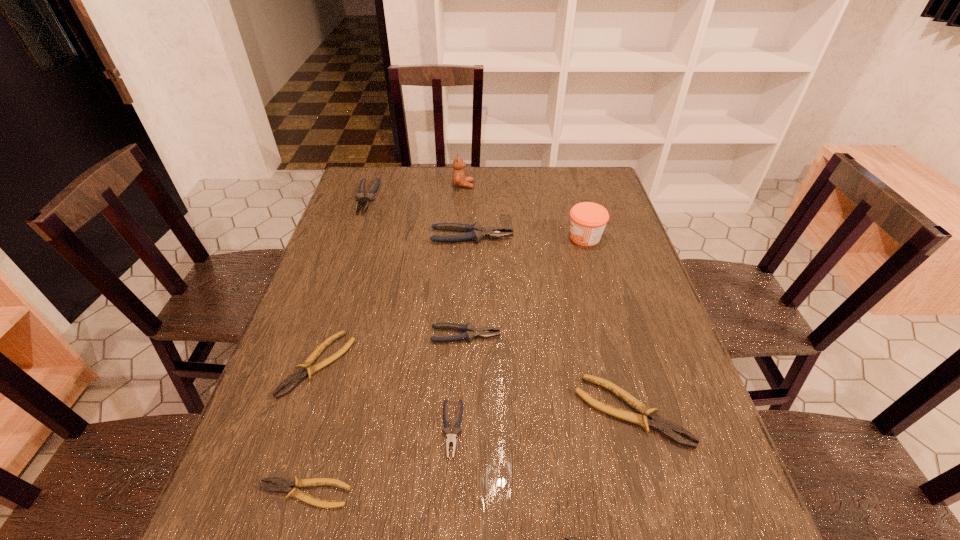
Where is `free space at the left edge of the desktop`? This screenshot has height=540, width=960. free space at the left edge of the desktop is located at coordinates [337, 312].

This screenshot has height=540, width=960. I want to click on vacant area at the right edge of the desktop, so click(x=619, y=326).

The width and height of the screenshot is (960, 540). What are the coordinates of `free region at the far left corner of the desktop` in the screenshot? It's located at (349, 192).

Image resolution: width=960 pixels, height=540 pixels. What are the coordinates of `vacant region at the far right corner of the desktop` in the screenshot? It's located at (576, 174).

The width and height of the screenshot is (960, 540). I want to click on vacant area that lies between the biggest yellow pliers and the nearest gray pliers, so click(x=541, y=420).

At what (x,y) coordinates should I click in order to perform the action: click on empty space that is in between the third smallest yellow pliers and the seventh shortest object. Please return your answer as a coordinate pair (x, y). This screenshot has height=540, width=960. Looking at the image, I should click on point(342,281).

Locate an element on the screen. vacant area between the seventh shortest object and the second nearest object is located at coordinates (335, 346).

Locate an element on the screen. The width and height of the screenshot is (960, 540). empty location between the fourth tallest object and the biggest yellow pliers is located at coordinates (499, 305).

At what (x,y) coordinates should I click in order to perform the action: click on free space between the third smallest yellow pliers and the tallest object. Please return your answer as a coordinate pair (x, y). This screenshot has width=960, height=540. Looking at the image, I should click on (391, 275).

Where is `free spot between the biggest yellow pliers and the jam`? free spot between the biggest yellow pliers and the jam is located at coordinates pos(608,324).